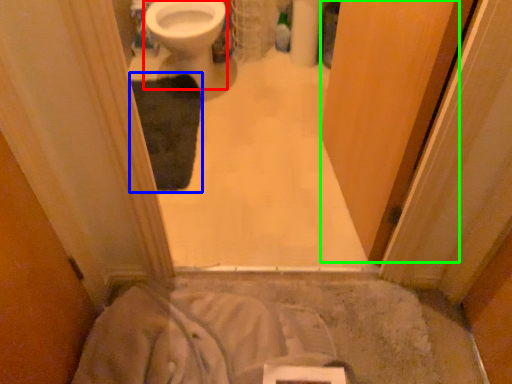
Question: Which object is the closest to the bidet (highlighted by a red box)? Choose among these: bath mat (highlighted by a blue box) or screen door (highlighted by a green box).

Choices:
 (A) bath mat
 (B) screen door

Answer: (A)